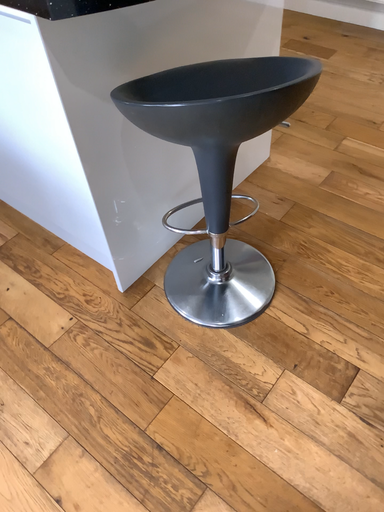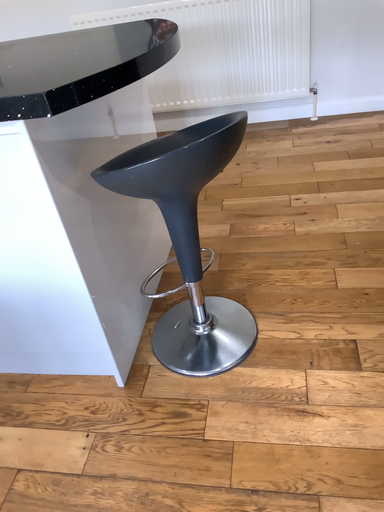
Question: How did the camera likely rotate when shooting the video?

Choices:
 (A) rotated downward
 (B) rotated upward

Answer: (B)